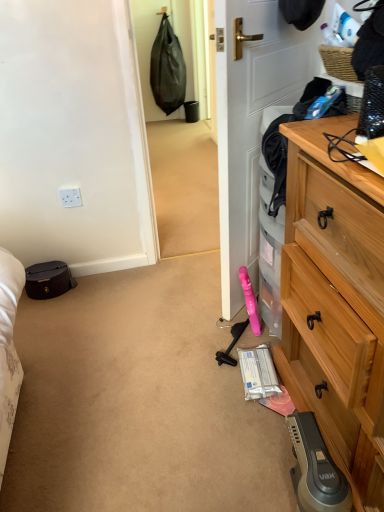
Question: From a real-world perspective, is matte black suitcase at left physically located above or below wooden chest of drawers at right?

Choices:
 (A) below
 (B) above

Answer: (A)

Question: Is matte black suitcase at left wider or thinner than wooden chest of drawers at right?

Choices:
 (A) wide
 (B) thin

Answer: (B)

Question: Considering the real-world distances, which object is farthest from the white matte door at center?

Choices:
 (A) wooden chest of drawers at right
 (B) white plastic power outlet at upper left
 (C) woven brown picnic basket at upper right
 (D) matte black suitcase at left

Answer: (D)

Question: Considering the real-world distances, which object is farthest from the white matte door at center?

Choices:
 (A) woven brown picnic basket at upper right
 (B) matte black suitcase at left
 (C) wooden chest of drawers at right
 (D) white plastic power outlet at upper left

Answer: (B)